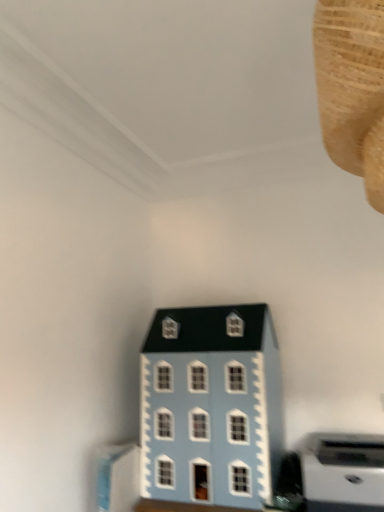
The width and height of the screenshot is (384, 512). I want to click on light blue plastic toy house at lower center, so click(211, 406).

The height and width of the screenshot is (512, 384). What do you see at coordinates (211, 406) in the screenshot?
I see `light blue plastic toy house at lower center` at bounding box center [211, 406].

Looking at this image, what is the approximate width of light blue plastic toy house at lower center?

14.77 inches.

The width and height of the screenshot is (384, 512). In order to click on light blue plastic toy house at lower center in this screenshot , I will do `click(211, 406)`.